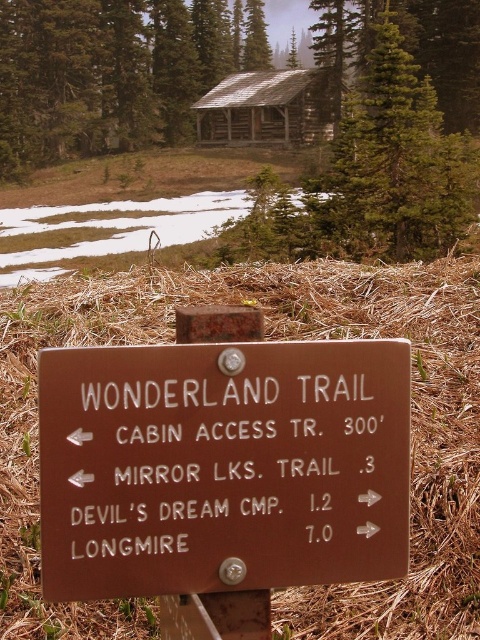
Does green textured log cabin at upper center appear on the right side of wooden cabin at upper center?

Yes, green textured log cabin at upper center is to the right of wooden cabin at upper center.

Can you confirm if green textured log cabin at upper center is shorter than wooden cabin at upper center?

No.

Between point (416, 173) and point (316, 83), which one is positioned behind?

Point (316, 83)

Identify the location of green textured log cabin at upper center. (384, 150).

Is brown wooden sign at center closer to camera compared to green textured log cabin at upper center?

Yes, it is in front of green textured log cabin at upper center.

The image size is (480, 640). Describe the element at coordinates (223, 467) in the screenshot. I see `brown wooden sign at center` at that location.

The image size is (480, 640). Identify the location of brown wooden sign at center. (223, 467).

Does brown wooden sign at center have a smaller size compared to wooden cabin at upper center?

Indeed, brown wooden sign at center has a smaller size compared to wooden cabin at upper center.

Which of these two, brown wooden sign at center or wooden cabin at upper center, stands taller?

Standing taller between the two is wooden cabin at upper center.

Who is more distant from viewer, [120,579] or [245,76]?

Positioned behind is point [245,76].

The image size is (480, 640). I want to click on brown wooden sign at center, so click(x=223, y=467).